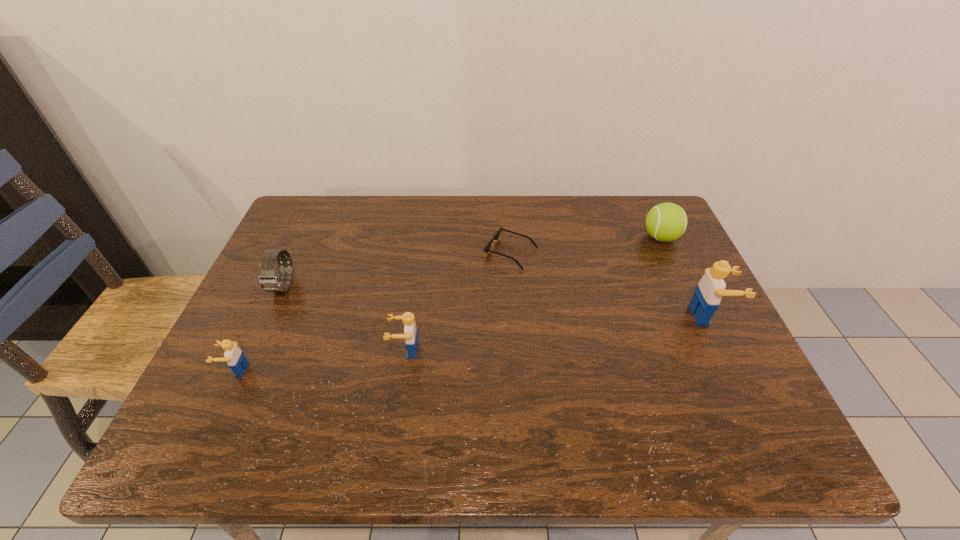
Locate an element on the screen. free point between the watch and the tennis ball is located at coordinates (472, 262).

What are the coordinates of `free point between the second tallest Lego and the leftmost Lego` in the screenshot? It's located at (321, 360).

Locate which object ranks fifth in proximity to the farthest Lego. Please provide its 2D coordinates. Your answer should be formatted as a tuple, i.e. [(x, y)], where the tuple contains the x and y coordinates of a point satisfying the conditions above.

[(234, 356)]

Select which object is the fifth closest to the tennis ball. Please provide its 2D coordinates. Your answer should be formatted as a tuple, i.e. [(x, y)], where the tuple contains the x and y coordinates of a point satisfying the conditions above.

[(234, 356)]

Identify which Lego is the nearest to the tennis ball. Please provide its 2D coordinates. Your answer should be formatted as a tuple, i.e. [(x, y)], where the tuple contains the x and y coordinates of a point satisfying the conditions above.

[(709, 291)]

Locate an element on the screen. The width and height of the screenshot is (960, 540). Lego that is the second closest to the sunglasses is located at coordinates (709, 291).

The image size is (960, 540). In order to click on free spot that satisfies the following two spatial constraints: 1. on the lenses of the sunglasses; 2. on the face of the watch in this screenshot , I will do `click(514, 286)`.